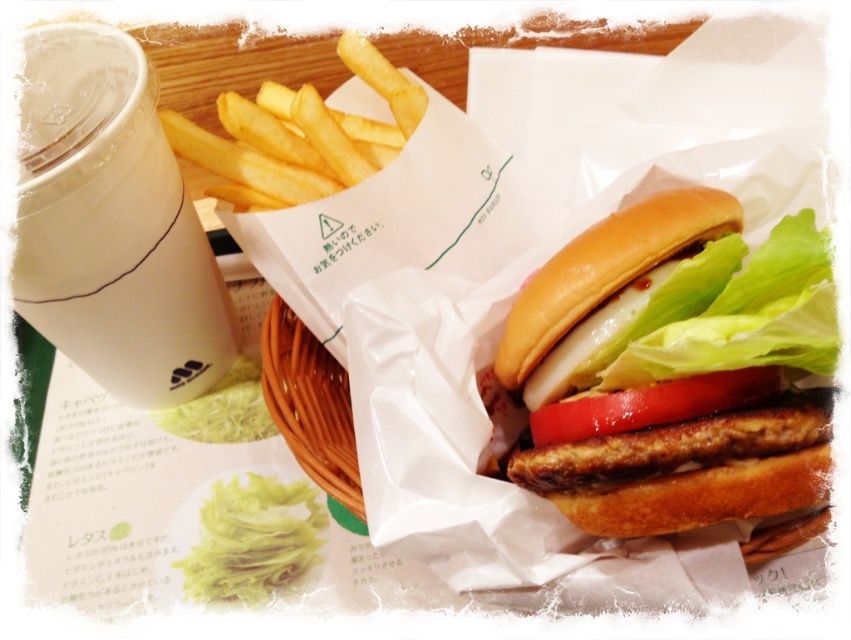
Does point (604, 381) lie behind point (278, 177)?

No, it is in front of (278, 177).

Can you confirm if green leafy lettuce at center is positioned to the left of yellow crispy french fries at upper left?

No, green leafy lettuce at center is not to the left of yellow crispy french fries at upper left.

Is point (740, 348) in front of point (266, 173)?

Yes, it is.

At what (x,y) coordinates should I click in order to perform the action: click on green leafy lettuce at center. Please return your answer as a coordinate pair (x, y). This screenshot has height=640, width=851. Looking at the image, I should click on (726, 314).

Is yellow crispy french fries at upper left smaller than brown woven basket at center?

Incorrect, yellow crispy french fries at upper left is not smaller in size than brown woven basket at center.

Is yellow crispy french fries at upper left shorter than brown woven basket at center?

In fact, yellow crispy french fries at upper left may be taller than brown woven basket at center.

Which is behind, point (338, 177) or point (338, 435)?

Positioned behind is point (338, 435).

I want to click on yellow crispy french fries at upper left, so click(x=300, y=134).

Is golden brown bun at center further to camera compared to white paper cup at upper left?

No, golden brown bun at center is in front of white paper cup at upper left.

Image resolution: width=851 pixels, height=640 pixels. What do you see at coordinates (675, 369) in the screenshot? I see `golden brown bun at center` at bounding box center [675, 369].

Locate an element on the screen. Image resolution: width=851 pixels, height=640 pixels. golden brown bun at center is located at coordinates (675, 369).